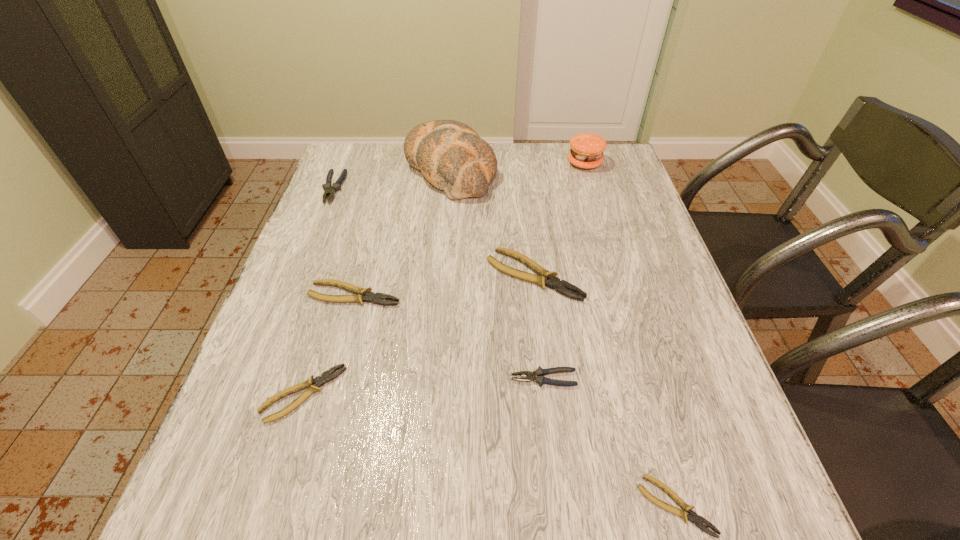
Identify the location of vacant space located on the front of the second shortest pliers. The height and width of the screenshot is (540, 960). (274, 490).

At what (x,y) coordinates should I click in order to perform the action: click on free space located on the left of the nearest yellow pliers. Please return your answer as a coordinate pair (x, y). Looking at the image, I should click on (571, 506).

This screenshot has width=960, height=540. Find the location of `bread located at the far edge`. bread located at the far edge is located at coordinates (450, 154).

Identify the location of patty situated at the far edge. Image resolution: width=960 pixels, height=540 pixels. (587, 149).

Where is `pliers present at the far edge`? pliers present at the far edge is located at coordinates (330, 191).

The width and height of the screenshot is (960, 540). I want to click on object that is positioned at the near edge, so click(x=693, y=517).

The width and height of the screenshot is (960, 540). What are the coordinates of `patty at the right edge` in the screenshot? It's located at (587, 149).

You are a GUI agent. You are given a task and a screenshot of the screen. Output one action in this format:
    pyautogui.click(x=<x>, y=<y>)
    Task: Click on the pliers located at the right edge
    
    Given the screenshot: What is the action you would take?
    pyautogui.click(x=693, y=517)

The image size is (960, 540). Identify the location of object that is at the far left corner. (330, 191).

This screenshot has height=540, width=960. In order to click on object at the far right corner in this screenshot , I will do `click(587, 149)`.